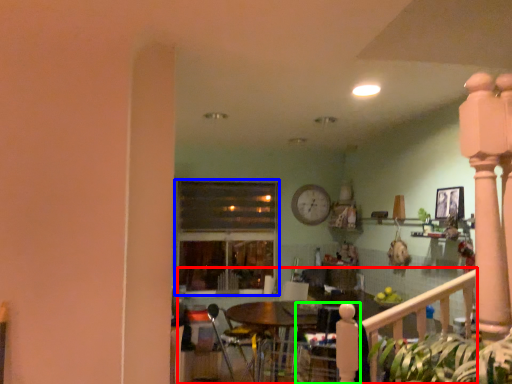
Question: Which object is the farthest from porch (highlighted by a red box)? Choose among these: window (highlighted by a blue box) or armchair (highlighted by a green box).

Choices:
 (A) window
 (B) armchair

Answer: (A)